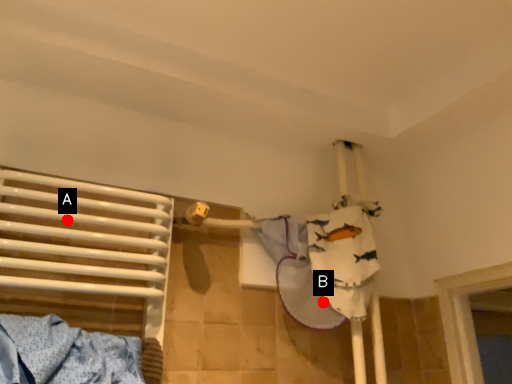
Question: Two points are circled on the image, labeled by A and B beside each circle. Which point appears farthest from the camera in this image?

Choices:
 (A) A is further
 (B) B is further

Answer: (B)